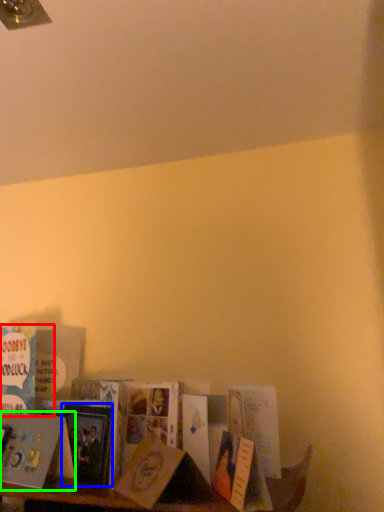
Question: Which is nearer to the book (highlighted by a red box)? paperback book (highlighted by a blue box) or book (highlighted by a green box).

Choices:
 (A) paperback book
 (B) book

Answer: (B)